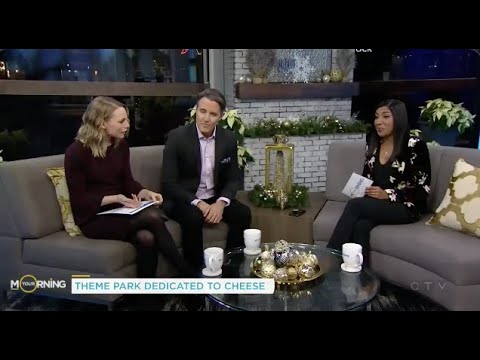
I want to click on paper card, so click(x=357, y=187).